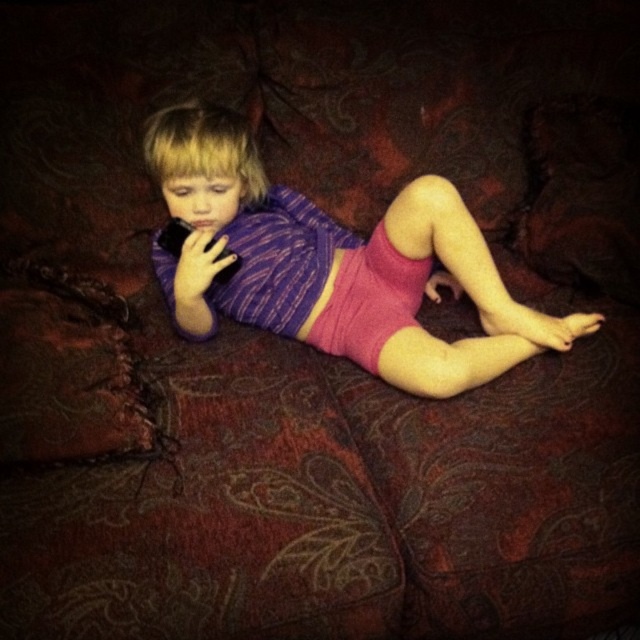
Who is more distant from viewer, (424,250) or (422,262)?

Positioned behind is point (422,262).

The height and width of the screenshot is (640, 640). I want to click on pink knitted shorts at center, so click(333, 262).